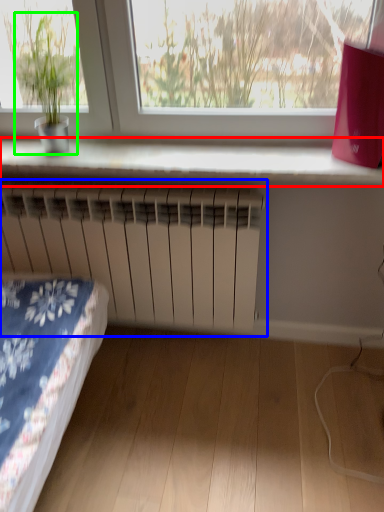
Question: Which is farther away from window sill (highlighted by a red box)? radiator (highlighted by a blue box) or houseplant (highlighted by a green box)?

Choices:
 (A) radiator
 (B) houseplant

Answer: (B)